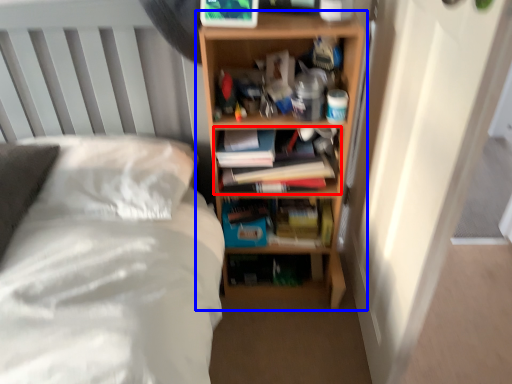
Question: Which point is closer to the camera, book (highlighted by a red box) or shelf (highlighted by a blue box)?

Choices:
 (A) book
 (B) shelf

Answer: (B)